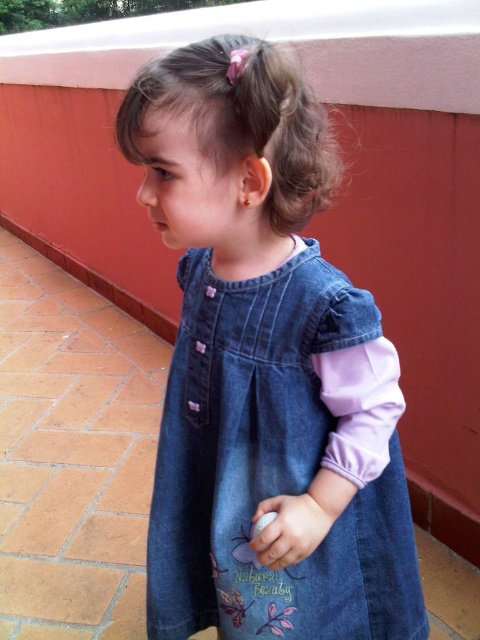
You are a photographer standing 24 inches away from the child wearing a denim dress at center. Can you take a clear photo without moving closer? Explain why.

The denim dress at center is 22.36 inches away from the viewer. Since you are standing 24 inches away, you are slightly farther than the dress, so you can take a clear photo without moving closer as the distance is within a reasonable range for focusing.

In the scene shown: Where is the denim dress at center located in the image?

The denim dress at center is located at point (264,364).